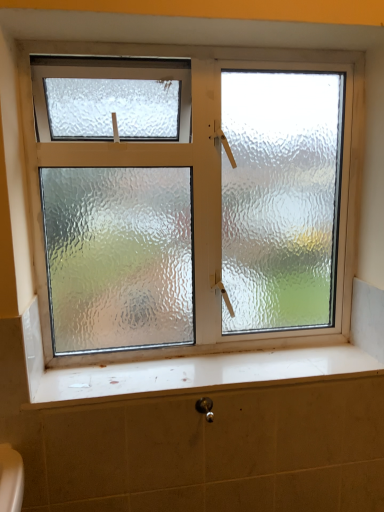
Question: From the image's perspective, relative to black metallic shower at lower center, is frosted glass window at center above or below?

Choices:
 (A) below
 (B) above

Answer: (B)

Question: Considering the relative positions of frosted glass window at center and black metallic shower at lower center in the image provided, is frosted glass window at center to the left or to the right of black metallic shower at lower center?

Choices:
 (A) left
 (B) right

Answer: (A)

Question: Which of these objects is positioned farthest from the frosted glass window at center?

Choices:
 (A) white glossy window sill at lower center
 (B) black metallic shower at lower center

Answer: (B)

Question: Estimate the real-world distances between objects in this image. Which object is closer to the black metallic shower at lower center?

Choices:
 (A) white glossy window sill at lower center
 (B) frosted glass window at center

Answer: (A)